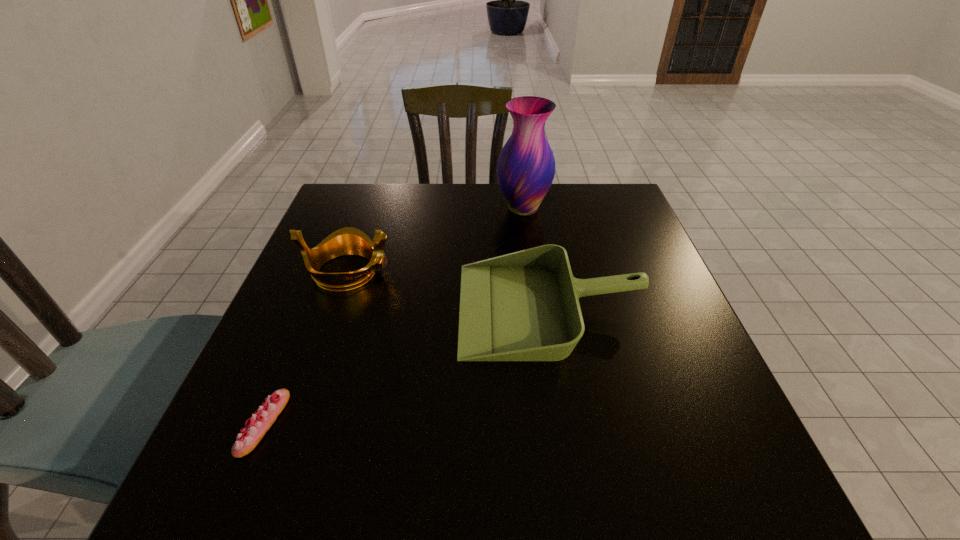
At what (x,y) coordinates should I click in order to perform the action: click on vase. Please return your answer as a coordinate pair (x, y). Looking at the image, I should click on (526, 166).

Image resolution: width=960 pixels, height=540 pixels. In order to click on the tallest object in this screenshot , I will do `click(526, 166)`.

At what (x,y) coordinates should I click in order to perform the action: click on tiara. Please return your answer as a coordinate pair (x, y). The image size is (960, 540). Looking at the image, I should click on (346, 241).

Find the location of a particular element. The width and height of the screenshot is (960, 540). dustpan is located at coordinates (523, 306).

Locate an element on the screen. This screenshot has width=960, height=540. the shortest object is located at coordinates (260, 422).

This screenshot has width=960, height=540. I want to click on the nearest object, so click(260, 422).

Where is `vacant region located 0.170m on the front of the vase`? vacant region located 0.170m on the front of the vase is located at coordinates (531, 264).

Identify the location of vacant point located at the front emblem of the tiara. (541, 271).

The width and height of the screenshot is (960, 540). In order to click on vacant region located 0.200m on the scoop of the dustpan in this screenshot , I will do `click(366, 308)`.

Image resolution: width=960 pixels, height=540 pixels. What are the coordinates of `vacant space situated on the scoop of the dustpan` in the screenshot? It's located at (296, 308).